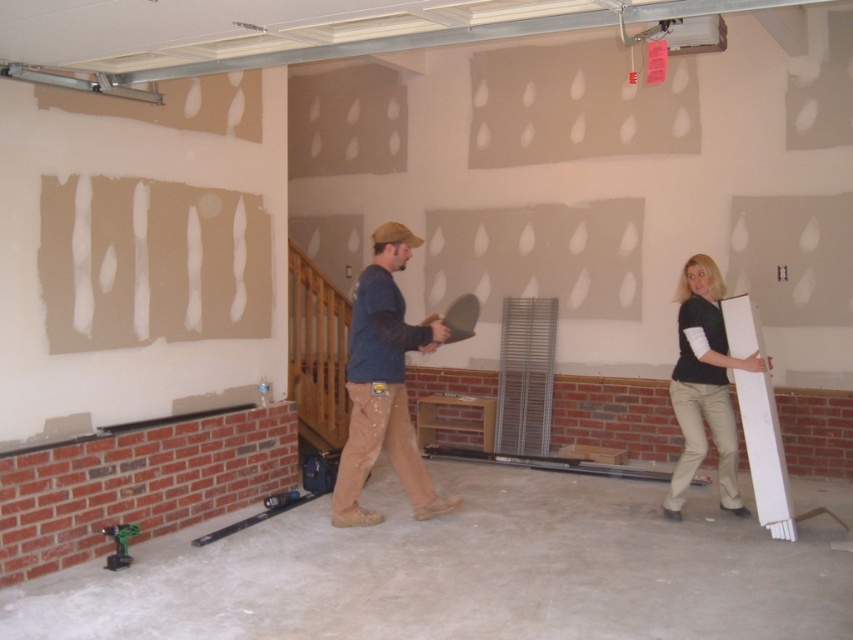
Which is in front, point (352, 493) or point (753, 353)?

Positioned in front is point (753, 353).

Is matte blue shirt at center to the left of white matte board at center from the viewer's perspective?

Indeed, matte blue shirt at center is positioned on the left side of white matte board at center.

This screenshot has width=853, height=640. What do you see at coordinates (384, 385) in the screenshot? I see `matte blue shirt at center` at bounding box center [384, 385].

Where is `matte blue shirt at center`? matte blue shirt at center is located at coordinates (384, 385).